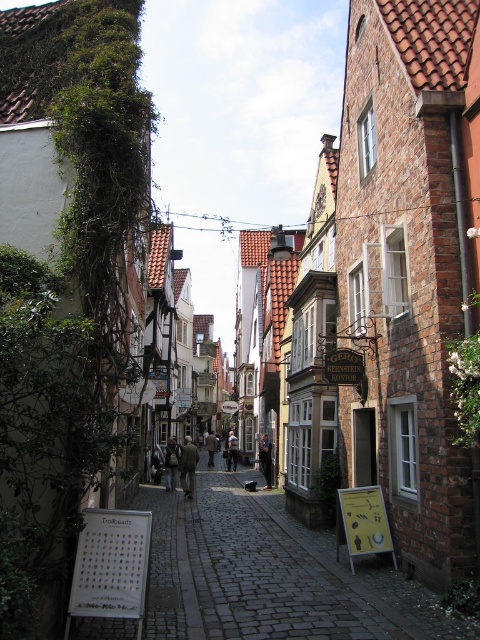
You are a tailor who needs to determine which item requires more fabric to repair. You see a dark brown leather coat at center and a light brown leather jacket at center. Which one needs more fabric?

The dark brown leather coat at center requires more fabric for repair because it is bigger than the light brown leather jacket at center.